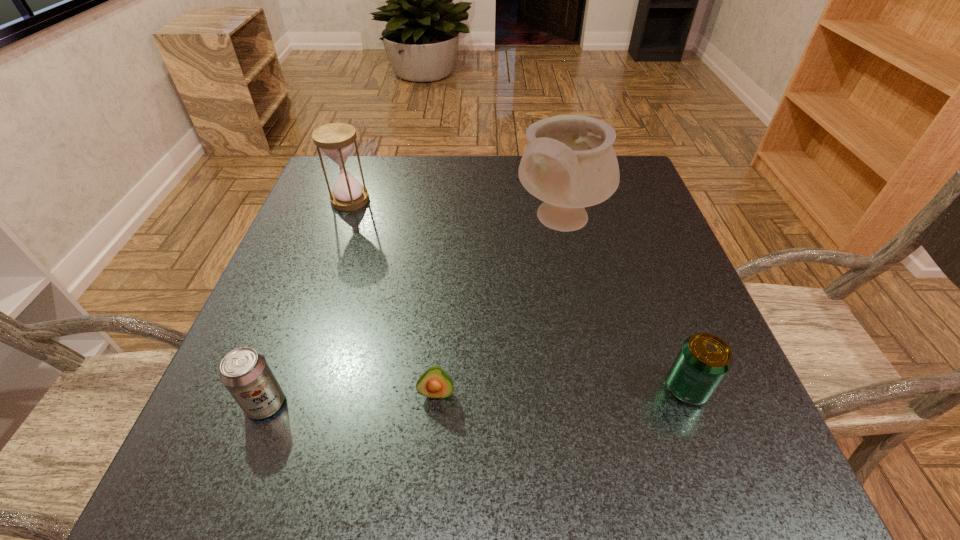
Where is `vacant space at the far edge of the desktop`? vacant space at the far edge of the desktop is located at coordinates (400, 176).

Where is `vacant space at the near edge of the desktop`? The width and height of the screenshot is (960, 540). vacant space at the near edge of the desktop is located at coordinates (321, 447).

This screenshot has width=960, height=540. I want to click on free space at the left edge of the desktop, so click(315, 271).

What are the coordinates of `vacant position at the right edge of the desktop` in the screenshot? It's located at (664, 284).

In order to click on free space at the far left corner of the desktop in this screenshot , I will do `click(369, 169)`.

You are a GUI agent. You are given a task and a screenshot of the screen. Output one action in this format:
    pyautogui.click(x=<x>, y=<y>)
    Task: Click on the vacant area at the near left corner
    This screenshot has width=960, height=540.
    Given the screenshot: What is the action you would take?
    pyautogui.click(x=194, y=492)

Image resolution: width=960 pixels, height=540 pixels. Find the location of `free space at the far right corner`. free space at the far right corner is located at coordinates (598, 207).

Locate an element on the screen. The width and height of the screenshot is (960, 540). free space between the fourth shortest object and the left beer can is located at coordinates (308, 301).

You are a GUI agent. You are given a task and a screenshot of the screen. Output one action in this format:
    pyautogui.click(x=<x>, y=<y>)
    Task: Click on the empty location between the left beer can and the hourglass
    Image resolution: width=960 pixels, height=540 pixels.
    Given the screenshot: What is the action you would take?
    pyautogui.click(x=308, y=301)

This screenshot has height=540, width=960. Find the location of `free spot between the right beer can and the fourth object from left to right`. free spot between the right beer can and the fourth object from left to right is located at coordinates (624, 305).